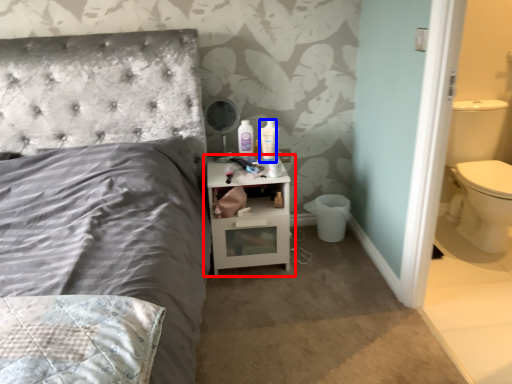
Question: Which object is closer to the camera taking this photo, nightstand (highlighted by a red box) or mouthwash (highlighted by a blue box)?

Choices:
 (A) nightstand
 (B) mouthwash

Answer: (A)